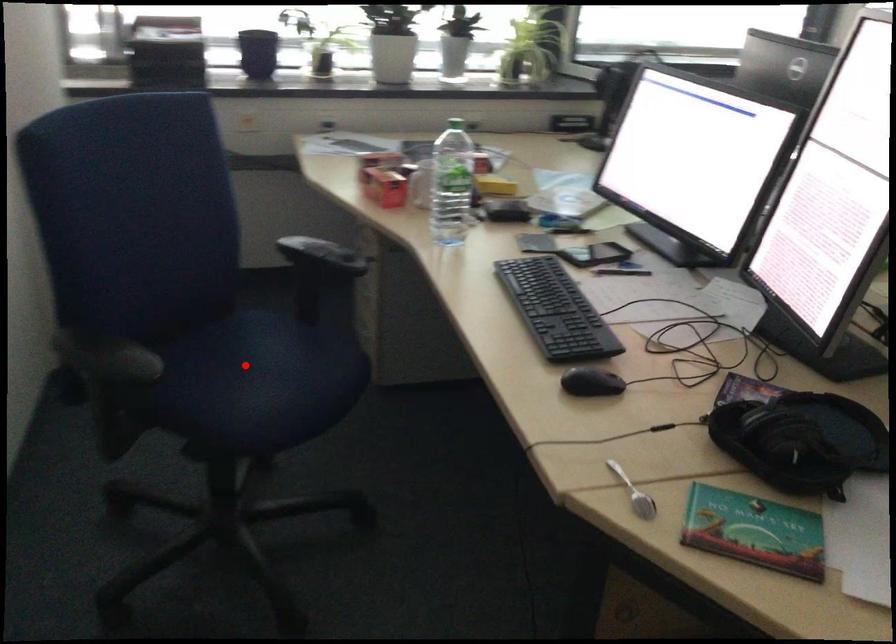
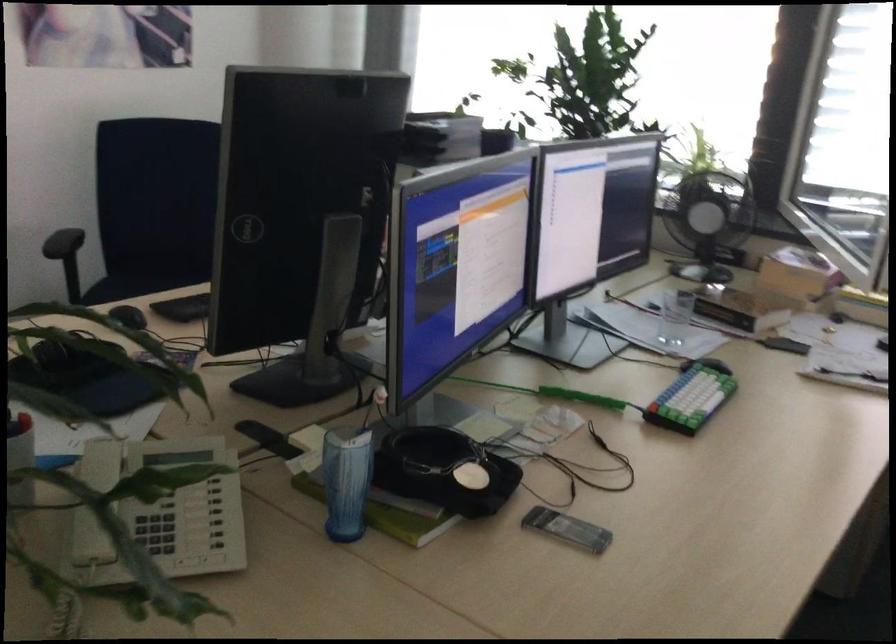
Question: I am providing you with two images of the same scene from different viewpoints. A red point is marked on the first image. Is the red point's position out of view in image 2?

Choices:
 (A) Yes
 (B) No

Answer: (A)